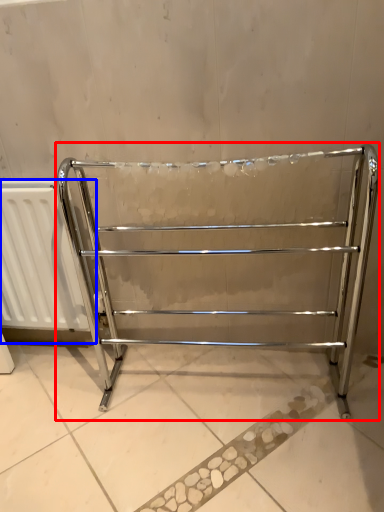
Question: Which object is closer to the camera taking this photo, furniture (highlighted by a red box) or radiator (highlighted by a blue box)?

Choices:
 (A) furniture
 (B) radiator

Answer: (A)